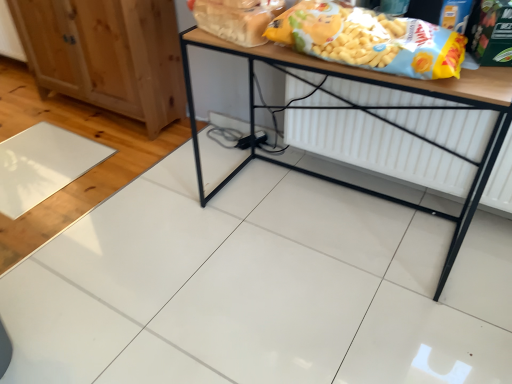
Question: From the image's perspective, would you say wooden table at center is shown under natural wood cabinet at left?

Choices:
 (A) yes
 (B) no

Answer: (A)

Question: Is wooden table at center with natural wood cabinet at left?

Choices:
 (A) no
 (B) yes

Answer: (A)

Question: Considering the relative positions of wooden table at center and natural wood cabinet at left in the image provided, is wooden table at center to the left of natural wood cabinet at left from the viewer's perspective?

Choices:
 (A) yes
 (B) no

Answer: (B)

Question: Is natural wood cabinet at left located within wooden table at center?

Choices:
 (A) yes
 (B) no

Answer: (B)

Question: Does wooden table at center have a lesser width compared to natural wood cabinet at left?

Choices:
 (A) no
 (B) yes

Answer: (A)

Question: Is wooden table at center facing towards natural wood cabinet at left?

Choices:
 (A) no
 (B) yes

Answer: (A)

Question: Considering the relative sizes of white matte radiator at lower center and natural wood cabinet at left in the image provided, is white matte radiator at lower center shorter than natural wood cabinet at left?

Choices:
 (A) yes
 (B) no

Answer: (A)

Question: Is white matte radiator at lower center looking in the opposite direction of natural wood cabinet at left?

Choices:
 (A) yes
 (B) no

Answer: (B)

Question: Is white matte radiator at lower center outside of natural wood cabinet at left?

Choices:
 (A) no
 (B) yes

Answer: (B)

Question: Does white matte radiator at lower center lie behind natural wood cabinet at left?

Choices:
 (A) no
 (B) yes

Answer: (A)

Question: From a real-world perspective, is white matte radiator at lower center on top of natural wood cabinet at left?

Choices:
 (A) yes
 (B) no

Answer: (B)

Question: Would you say white matte radiator at lower center is a long distance from natural wood cabinet at left?

Choices:
 (A) no
 (B) yes

Answer: (B)

Question: Is yellow matte cereal at upper right, acting as the first cereal starting from the right, aimed at natural wood cabinet at left?

Choices:
 (A) no
 (B) yes

Answer: (A)